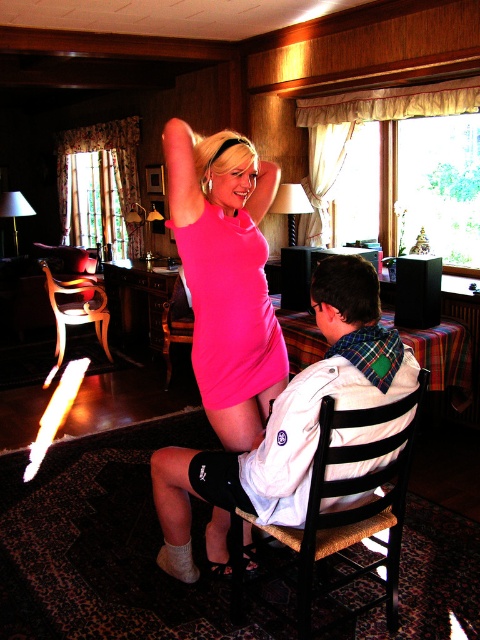
Does white cotton jacket at center appear over black wood chair at center?

Yes, white cotton jacket at center is above black wood chair at center.

Between white cotton jacket at center and black wood chair at center, which one has more height?

white cotton jacket at center

Measure the distance between point [160,456] and camera.

Point [160,456] is 2.13 meters away from camera.

At what (x,y) coordinates should I click in order to perform the action: click on white cotton jacket at center. Please return your answer as a coordinate pair (x, y). The image size is (480, 640). Looking at the image, I should click on (289, 419).

Is black wood chair at center to the left of wooden chair at left from the viewer's perspective?

Incorrect, black wood chair at center is not on the left side of wooden chair at left.

Is point (340, 460) more distant than point (103, 314)?

That is False.

This screenshot has width=480, height=640. What are the coordinates of `black wood chair at center` in the screenshot? It's located at (354, 508).

Identify the location of black wood chair at center. (354, 508).

Does pink matte dress at upper center have a greater width compared to matte pink dress at center?

Yes.

Who is positioned more to the right, pink matte dress at upper center or matte pink dress at center?

From the viewer's perspective, matte pink dress at center appears more on the right side.

Between point (166, 467) and point (190, 241), which one is positioned behind?

Point (166, 467)

The width and height of the screenshot is (480, 640). In order to click on pink matte dress at upper center in this screenshot , I will do `click(227, 275)`.